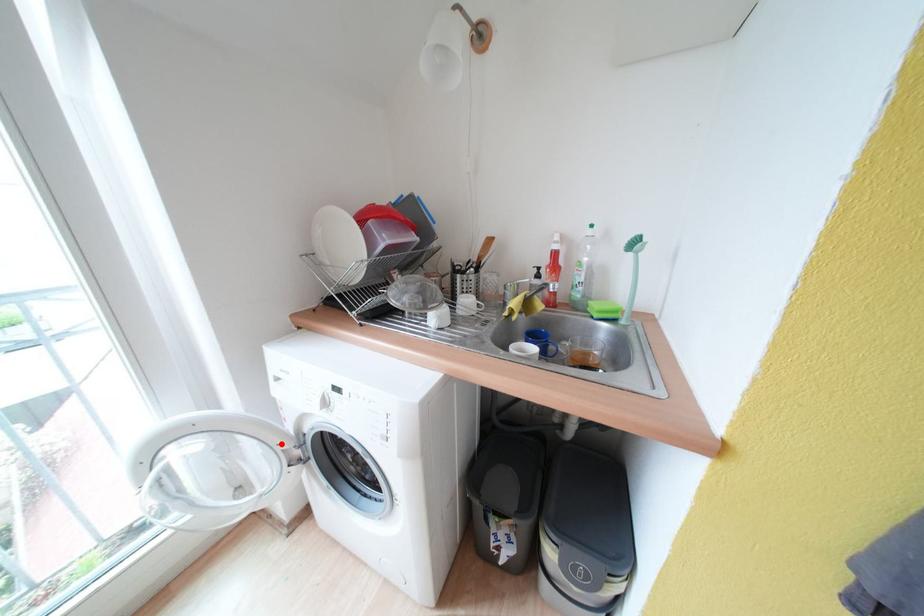
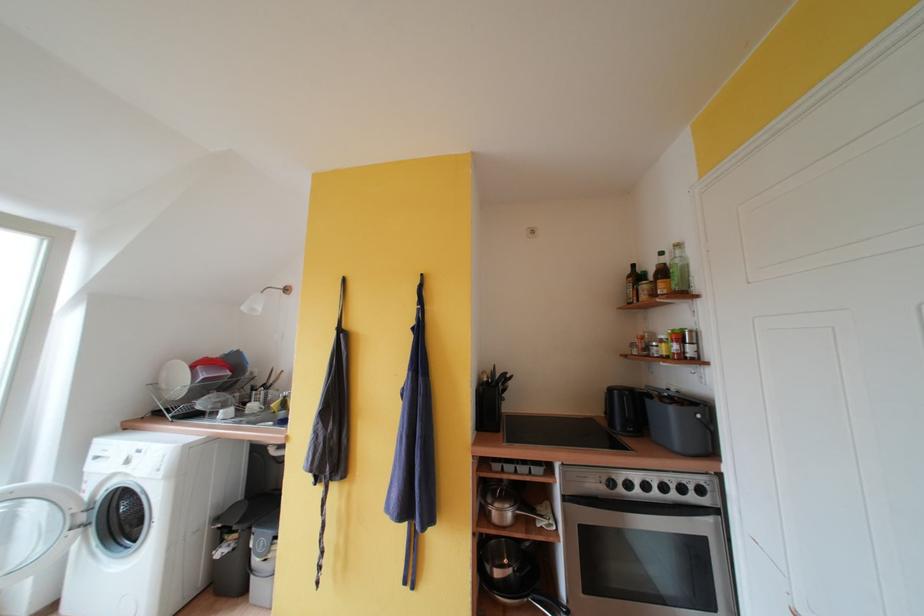
Locate, in the second image, the point that corresponds to the highlighted location in the first image.

(76, 509)